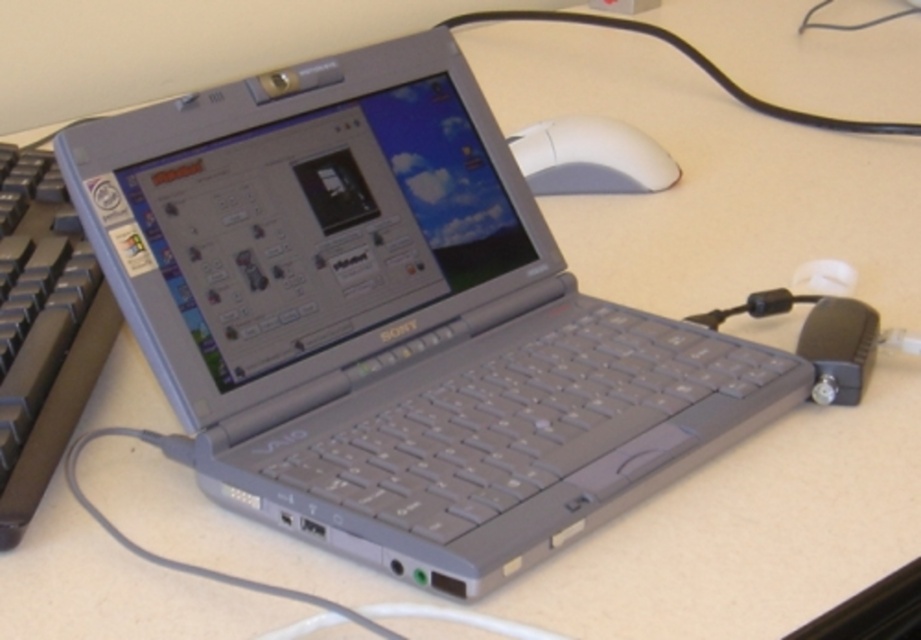
Does gray plastic keyboard at left have a smaller size compared to white matte mouse at upper right?

Actually, gray plastic keyboard at left might be larger than white matte mouse at upper right.

Is gray plastic keyboard at left above white matte mouse at upper right?

No, gray plastic keyboard at left is not above white matte mouse at upper right.

Locate an element on the screen. The height and width of the screenshot is (640, 921). gray plastic keyboard at left is located at coordinates (43, 330).